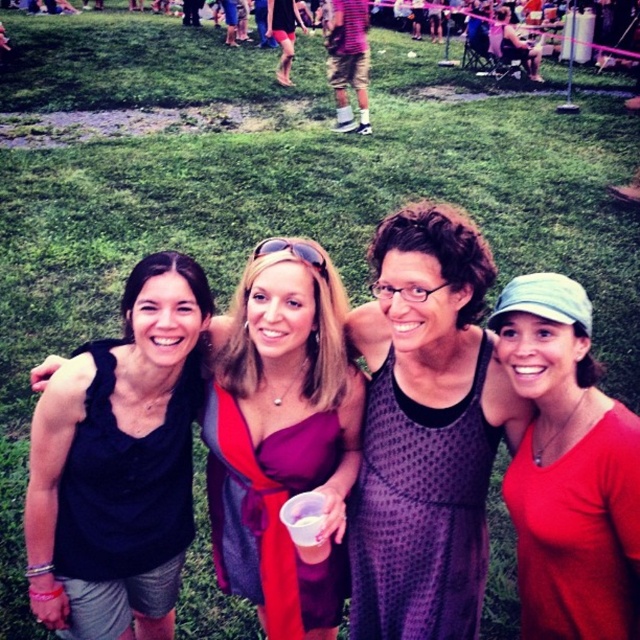
You are organizing a clothing donation drive and need to categorize items by their thickness. You have two items in front of you from the image described above. Which of the two items, the red matte shirt at center or the purple mesh dress at center, should be placed in the category for thinner garments?

The red matte shirt at center is thinner than the purple mesh dress at center, so it should be placed in the category for thinner garments.

You are standing in front of the group of four people in the image. There are two points marked in the scene. The first point is at coordinates point (604, 636), and the second point is at point (384, 570). Which of these two points is closer to you?

Point (604, 636) is closer to the camera than point (384, 570), so the first point is closer to you.

You are a photographer standing at the camera position. You want to take a closeup shot of the purple mesh dress at center. Can you reach it without moving your camera position?

The purple mesh dress at center is 2.88 meters away from camera, so yes, you can take a closeup shot without moving the camera position if your lens has sufficient zoom capability.